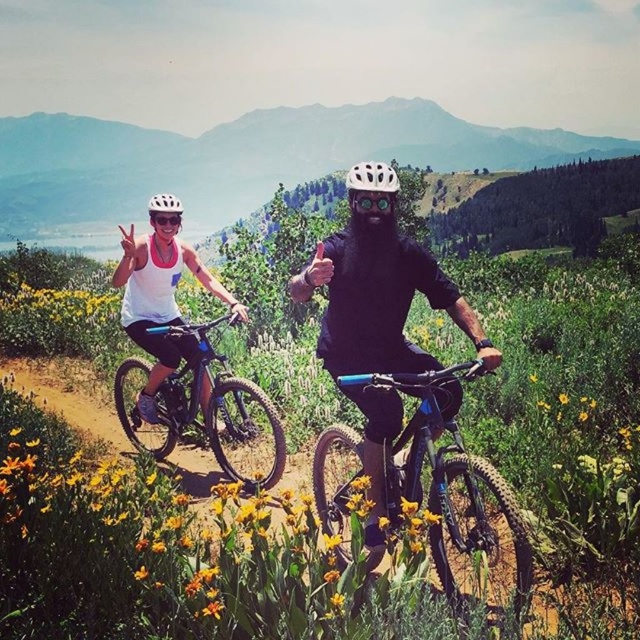
Question: Is matte black bicycle at center bigger than matte black bike at left?

Choices:
 (A) yes
 (B) no

Answer: (A)

Question: Is shiny black frame at center closer to camera compared to white matte helmet at center?

Choices:
 (A) yes
 (B) no

Answer: (A)

Question: Which of the following is the closest to the observer?

Choices:
 (A) black matte helmet at center
 (B) white matte helmet at upper center

Answer: (A)

Question: Among these objects, which one is farthest from the camera?

Choices:
 (A) white matte helmet at upper center
 (B) shiny black frame at center
 (C) black matte helmet at center

Answer: (A)

Question: Which is nearer to the matte black bike at left?

Choices:
 (A) matte black bicycle at center
 (B) shiny black frame at center
 (C) white matte bicycle helmet at center
 (D) white matte bicycle helmet at upper center

Answer: (A)

Question: Can you confirm if matte black bike at left is positioned to the right of white matte bicycle helmet at center?

Choices:
 (A) yes
 (B) no

Answer: (B)